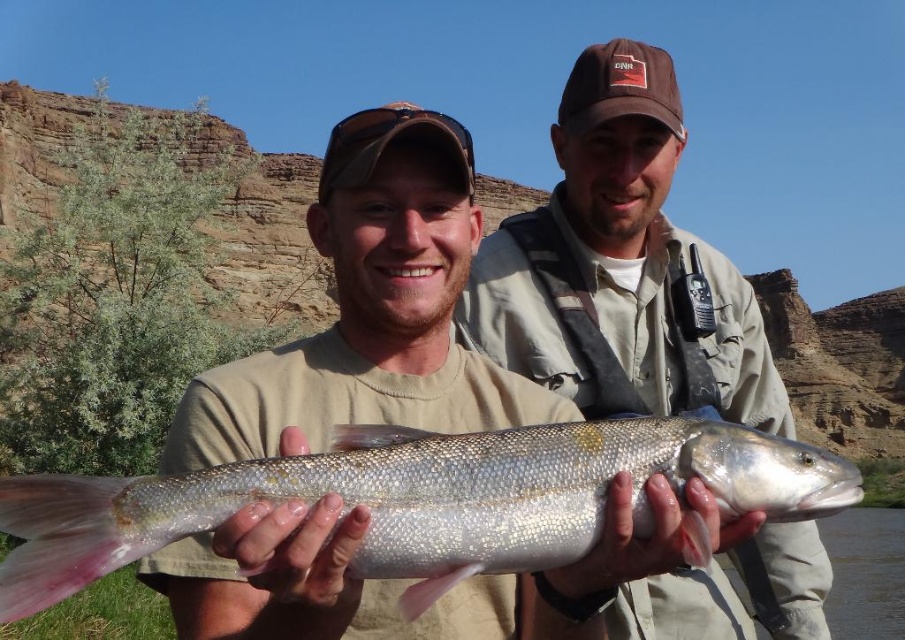
Question: Which object is the farthest from the shiny silver fish at center?

Choices:
 (A) matte beige shirt at center
 (B) shiny metallic fish at center

Answer: (B)

Question: Which object is positioned farthest from the matte beige shirt at center?

Choices:
 (A) shiny metallic fish at center
 (B) shiny silver fish at center

Answer: (A)

Question: From the image, what is the correct spatial relationship of matte beige shirt at center in relation to shiny metallic fish at center?

Choices:
 (A) above
 (B) below

Answer: (B)

Question: Which point appears farthest from the camera in this image?

Choices:
 (A) (337, 362)
 (B) (456, 500)
 (C) (651, 125)

Answer: (C)

Question: Can you confirm if matte beige shirt at center is thinner than shiny metallic fish at center?

Choices:
 (A) no
 (B) yes

Answer: (A)

Question: From the image, what is the correct spatial relationship of matte beige shirt at center in relation to shiny metallic fish at center?

Choices:
 (A) below
 (B) above

Answer: (A)